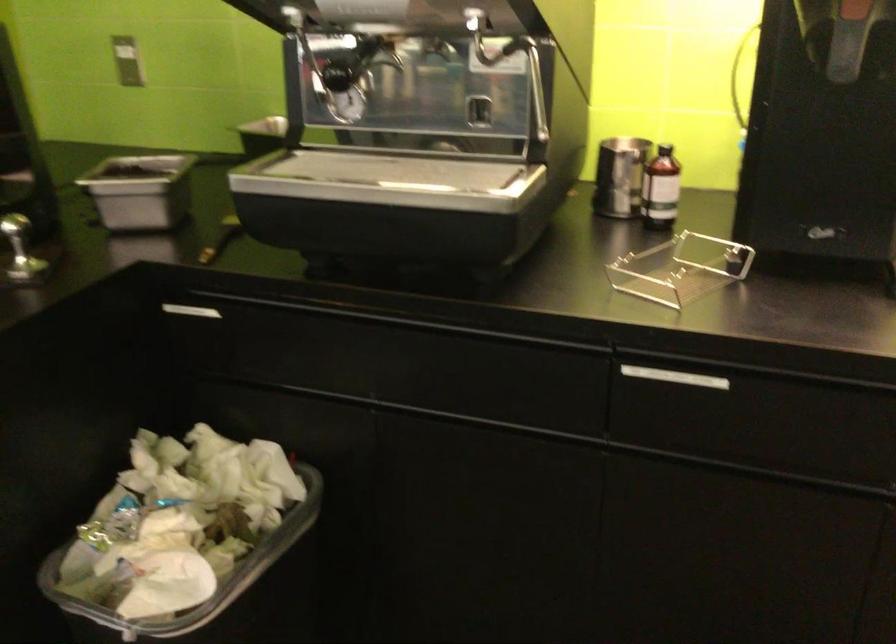
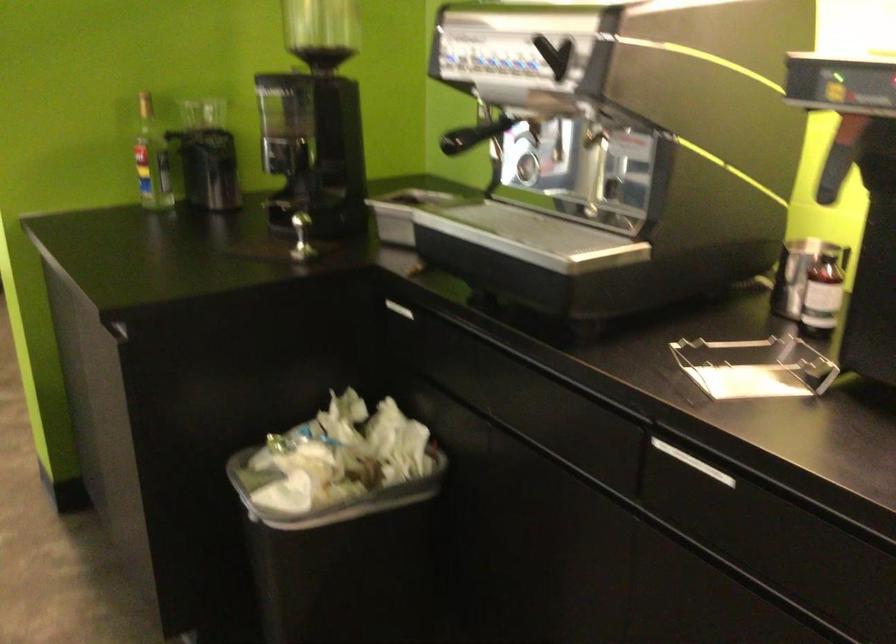
Question: The first image is from the beginning of the video and the second image is from the end. How did the camera likely rotate when shooting the video?

Choices:
 (A) Left
 (B) Right
 (C) Up
 (D) Down

Answer: (A)